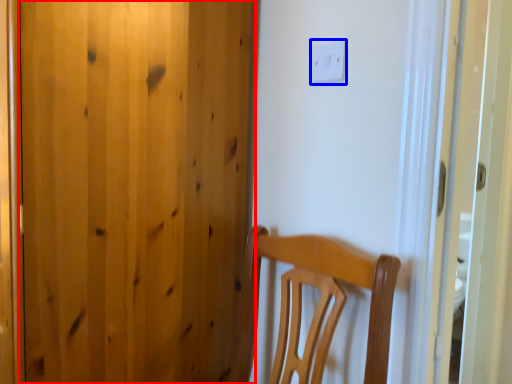
Question: Which point is closer to the camera, door (highlighted by a red box) or light switch (highlighted by a blue box)?

Choices:
 (A) door
 (B) light switch

Answer: (A)